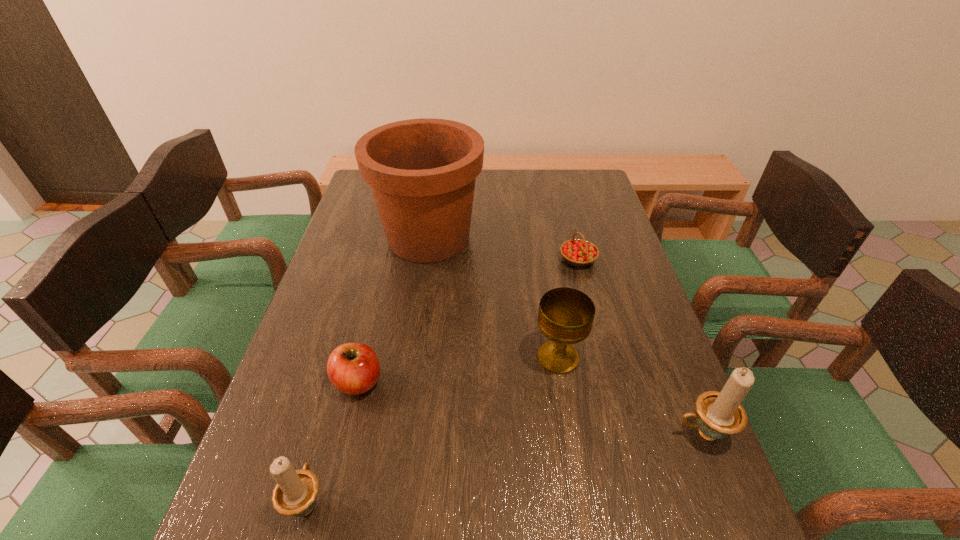
The width and height of the screenshot is (960, 540). Find the location of `free space that satisfies the following two spatial constraints: 1. on the handle side of the nearer candle_holder; 2. on the right side of the second shortest object`. free space that satisfies the following two spatial constraints: 1. on the handle side of the nearer candle_holder; 2. on the right side of the second shortest object is located at coordinates (341, 382).